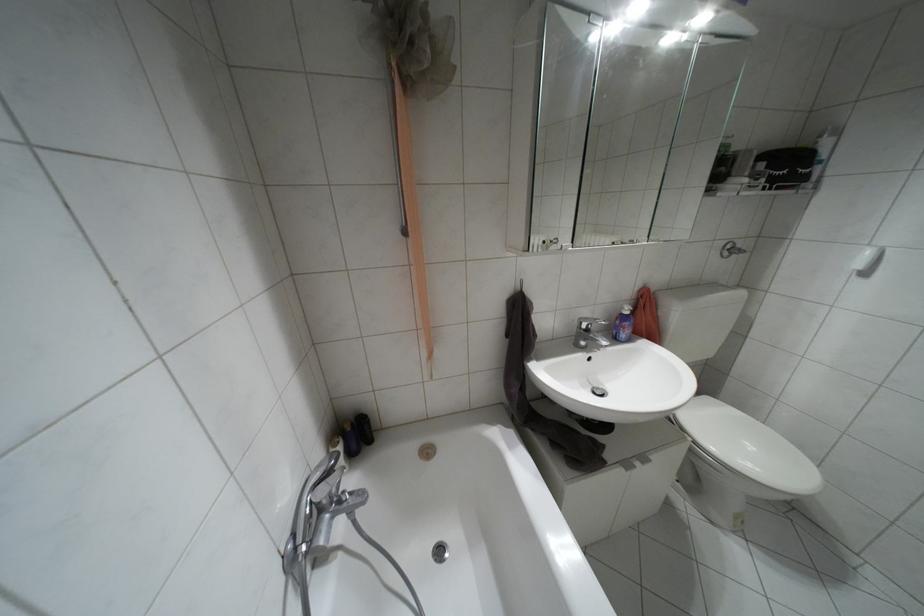
I want to click on mirrored cabinet door, so click(x=642, y=240).